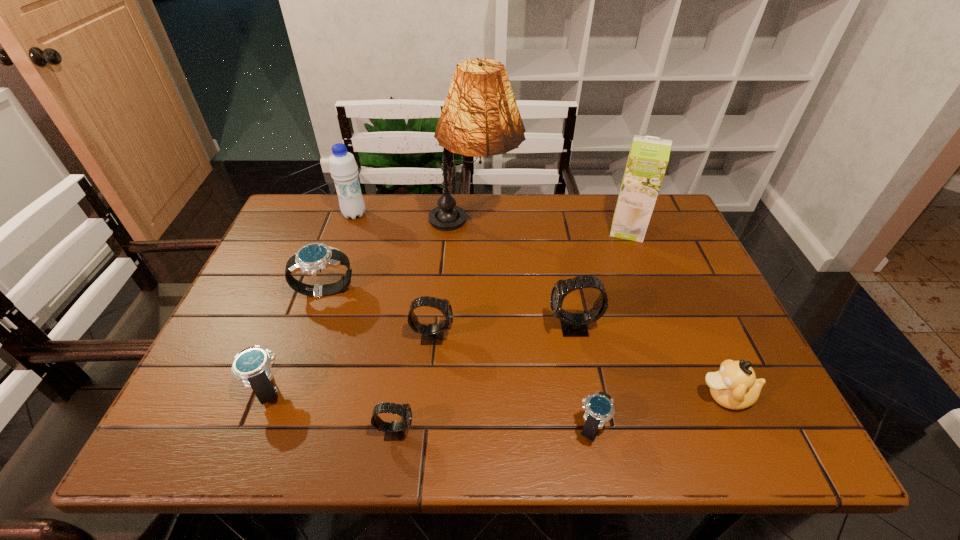
This screenshot has height=540, width=960. I want to click on the tallest object, so click(480, 117).

This screenshot has height=540, width=960. I want to click on green soya milk, so click(648, 158).

Find the location of a particular element. soya milk is located at coordinates (648, 158).

Identify the location of blue water bottle. The height and width of the screenshot is (540, 960). (343, 168).

I want to click on the eighth shortest object, so click(x=343, y=168).

In order to click on the biggest gray watch in this screenshot , I will do `click(573, 324)`.

Identify the location of the fourth tallest object. (573, 324).

The width and height of the screenshot is (960, 540). I want to click on the farthest watch, so click(x=313, y=258).

The height and width of the screenshot is (540, 960). Identify the location of the fourth farthest object. (313, 258).

Find the location of `the second biggest gray watch`. the second biggest gray watch is located at coordinates (432, 334).